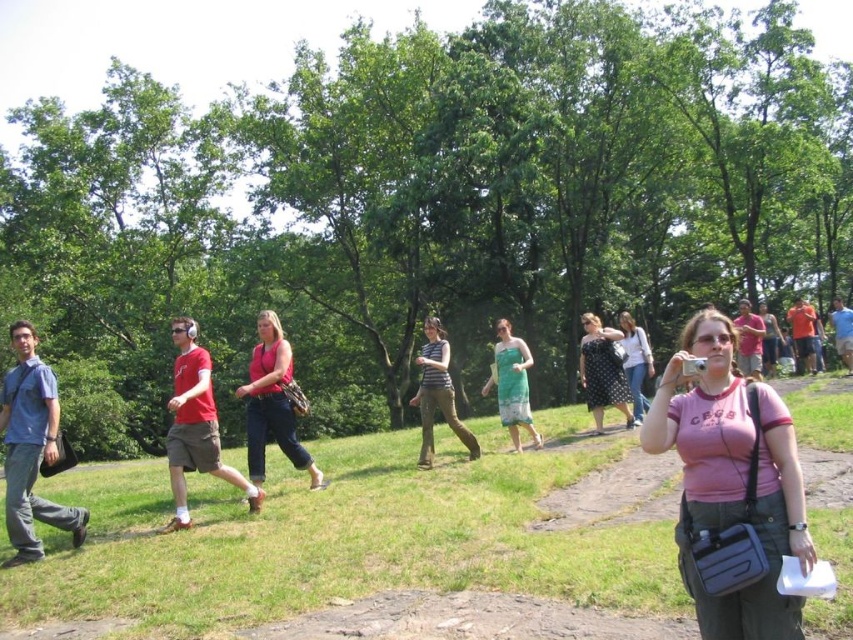
Does matte red t-shirt at center have a lesser height compared to matte pink tank top at center?

Yes, matte red t-shirt at center is shorter than matte pink tank top at center.

Between point (245, 490) and point (279, 337), which one is positioned in front?

Point (245, 490) is in front.

I want to click on matte red t-shirt at center, so click(x=195, y=426).

Image resolution: width=853 pixels, height=640 pixels. I want to click on matte red t-shirt at center, so click(x=195, y=426).

From the picture: Which is below, matte red t-shirt at center or black dotted dress at center?

matte red t-shirt at center

Can you confirm if matte red t-shirt at center is taller than black dotted dress at center?

Yes.

Does point (173, 481) lie behind point (608, 396)?

No.

You are a GUI agent. You are given a task and a screenshot of the screen. Output one action in this format:
    pyautogui.click(x=<x>, y=<y>)
    Task: Click on the matte red t-shirt at center
    Image resolution: width=853 pixels, height=640 pixels.
    Given the screenshot: What is the action you would take?
    pyautogui.click(x=195, y=426)

Is point (73, 518) positioned after point (427, 467)?

No.

Is point (9, 516) in front of point (442, 394)?

Yes.

The height and width of the screenshot is (640, 853). In order to click on matte blue shirt at left in this screenshot , I will do `click(32, 449)`.